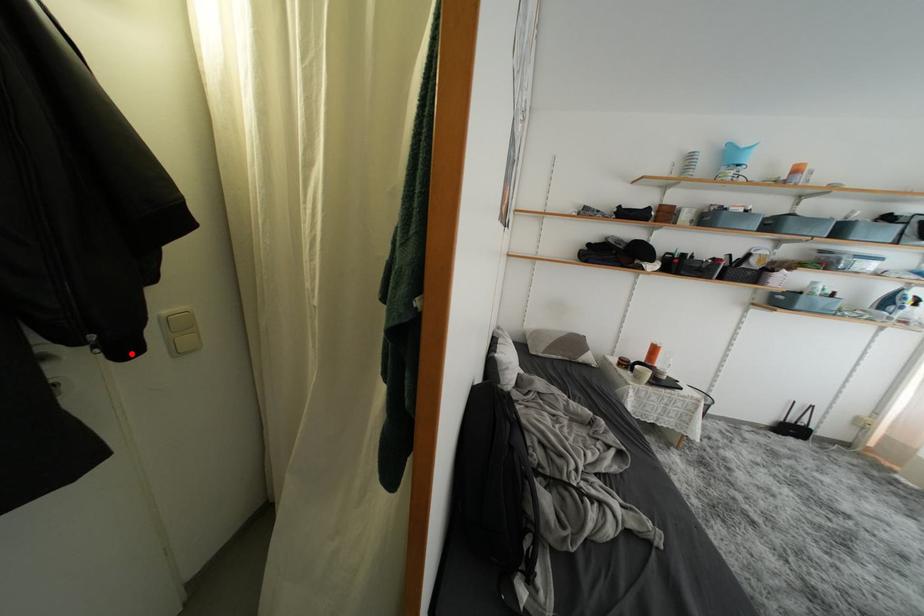
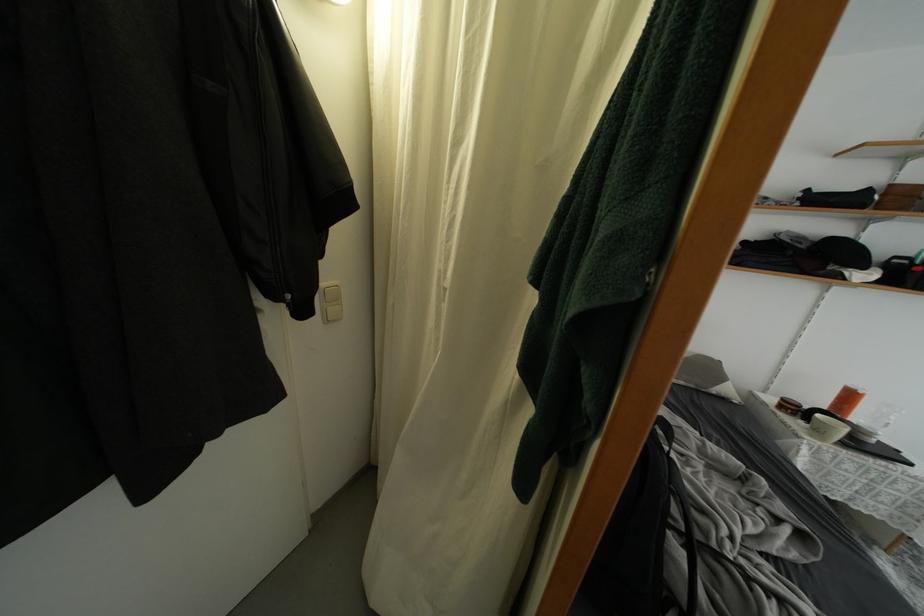
In the second image, find the point that corresponds to the highlighted location in the first image.

(310, 315)